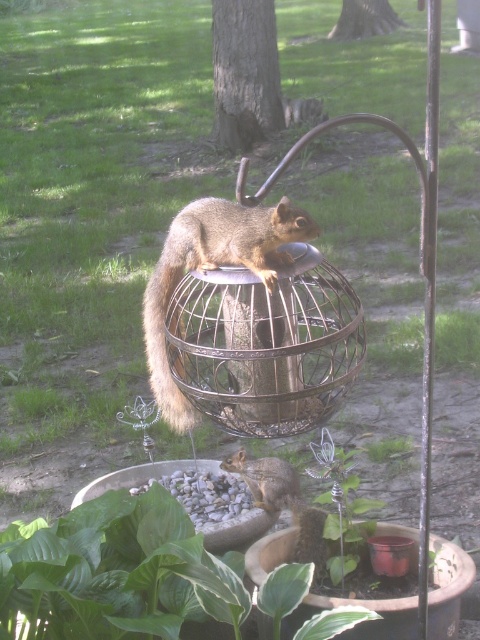
Question: Which is nearer to the brown furry squirrel at center?

Choices:
 (A) brown rough bark tree at upper center
 (B) fuzzy brown tail at center
 (C) brown furry squirrel at lower center
 (D) brown textured tree trunk at upper center

Answer: (B)

Question: From the image, what is the correct spatial relationship of fuzzy brown tail at center in relation to brown textured tree trunk at upper center?

Choices:
 (A) left
 (B) right

Answer: (A)

Question: Which point is farther to the camera?

Choices:
 (A) brown furry squirrel at center
 (B) fuzzy brown tail at center
 (C) brown textured tree trunk at upper center
 (D) brown furry squirrel at lower center

Answer: (C)

Question: Among these points, which one is farthest from the camera?

Choices:
 (A) (240, 257)
 (B) (285, 499)
 (C) (228, 81)

Answer: (C)

Question: Is brown rough bark tree at upper center smaller than fuzzy brown tail at center?

Choices:
 (A) no
 (B) yes

Answer: (A)

Question: From the image, what is the correct spatial relationship of brown rough bark tree at upper center in relation to fuzzy brown tail at center?

Choices:
 (A) above
 (B) below

Answer: (A)